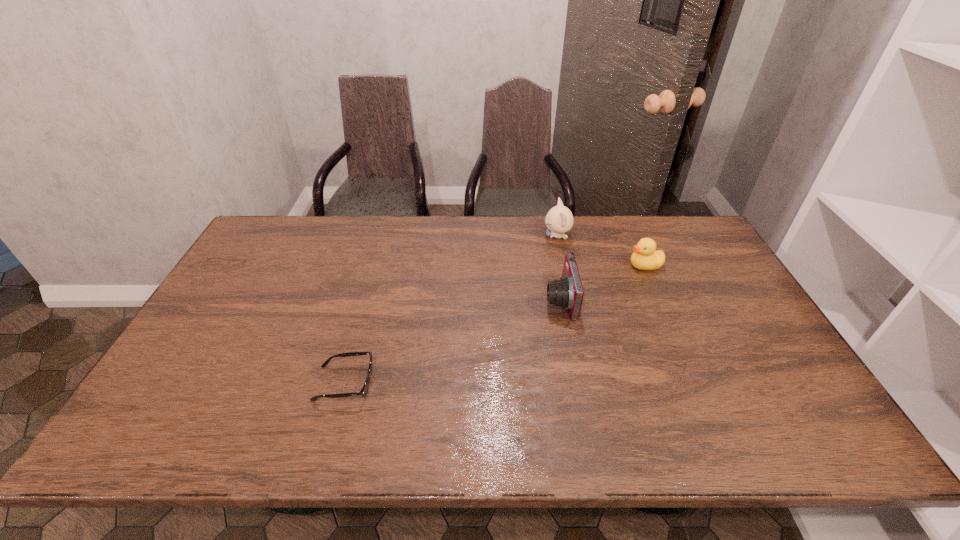
The width and height of the screenshot is (960, 540). In the image, there is a desktop. In order to click on vacant space at the right edge in this screenshot , I will do `click(793, 392)`.

Where is `free space at the far right corner`? free space at the far right corner is located at coordinates (667, 224).

Identify the location of vacant area that lies between the nearest object and the farthest object. (451, 309).

Where is `vacant point located between the shortest object and the kitten`? Image resolution: width=960 pixels, height=540 pixels. vacant point located between the shortest object and the kitten is located at coordinates (451, 309).

Find the location of `free area in between the leftmost object and the kitten`. free area in between the leftmost object and the kitten is located at coordinates (451, 309).

Find the location of a particular element. This screenshot has height=540, width=960. free space that is in between the rightmost object and the camera is located at coordinates (602, 282).

Locate an element on the screen. The width and height of the screenshot is (960, 540). vacant area that lies between the rightmost object and the camera is located at coordinates (602, 282).

This screenshot has width=960, height=540. I want to click on free space between the nearest object and the kitten, so click(451, 309).

Where is `vacant point located between the shortest object and the camera`? vacant point located between the shortest object and the camera is located at coordinates (452, 341).

Where is `unoccupied position between the duck and the second nearest object`? This screenshot has height=540, width=960. unoccupied position between the duck and the second nearest object is located at coordinates (602, 282).